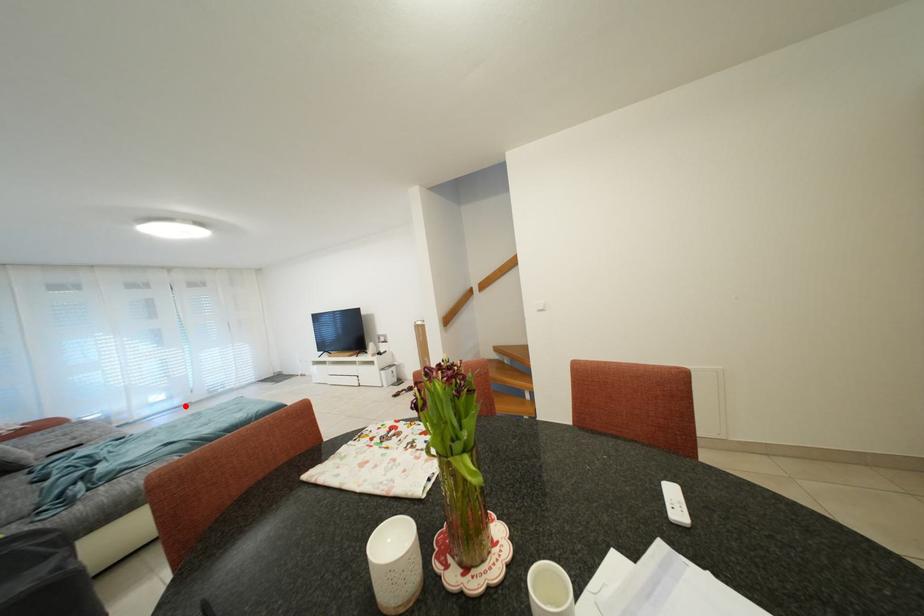
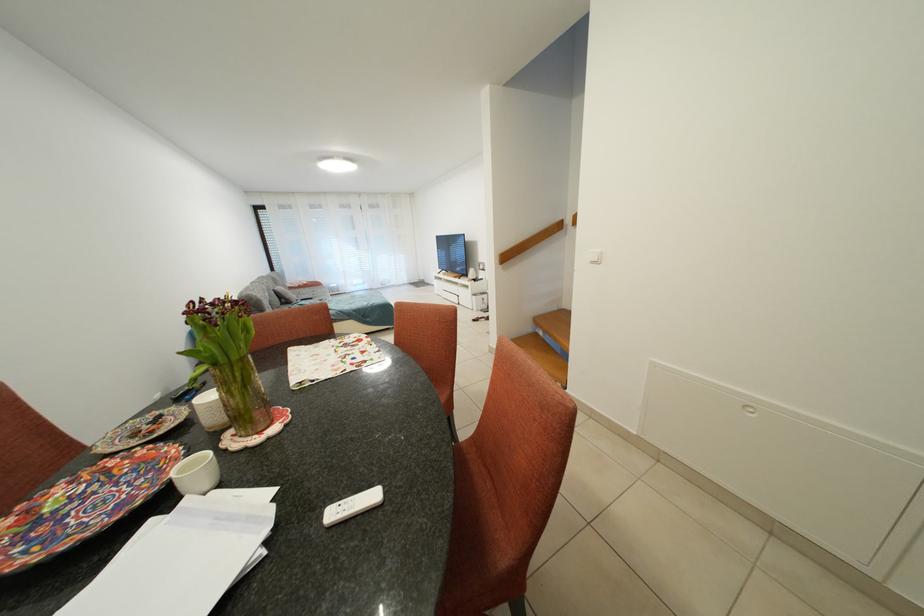
Where in the second image is the point corresponding to the highlighted location from the first image?

(373, 291)